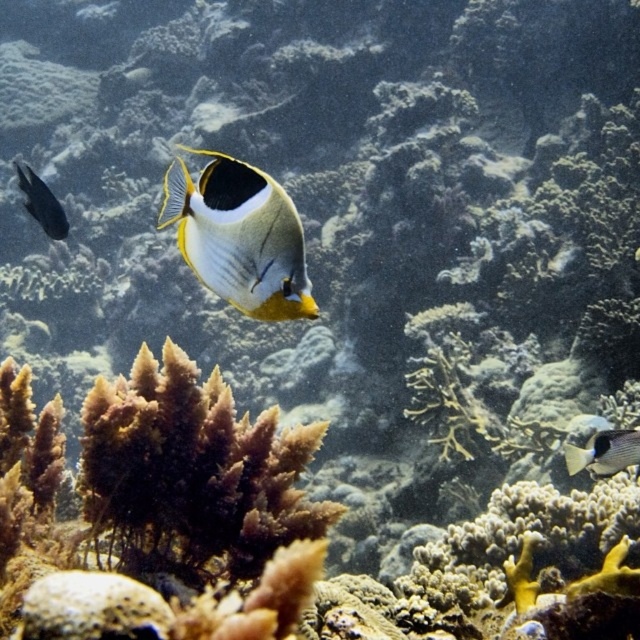
Can you confirm if yellow and white butterflyfish at center is wider than shiny black fish at left?

No, yellow and white butterflyfish at center is not wider than shiny black fish at left.

Is yellow and white butterflyfish at center thinner than shiny black fish at left?

Yes.

Does point (308, 317) lie in front of point (61, 209)?

Yes, point (308, 317) is in front of point (61, 209).

The height and width of the screenshot is (640, 640). Find the location of `yellow and white butterflyfish at center`. yellow and white butterflyfish at center is located at coordinates (240, 236).

Does yellow and white butterflyfish at center appear over gray matte fish at right?

Yes, yellow and white butterflyfish at center is above gray matte fish at right.

Can you confirm if yellow and white butterflyfish at center is smaller than gray matte fish at right?

No, yellow and white butterflyfish at center is not smaller than gray matte fish at right.

Which is behind, point (262, 173) or point (612, 460)?

The point (612, 460) is more distant.

Find the location of a particular element. yellow and white butterflyfish at center is located at coordinates (240, 236).

Between gray matte fish at right and shiny black fish at left, which one is positioned higher?

shiny black fish at left is higher up.

Who is taller, gray matte fish at right or shiny black fish at left?

shiny black fish at left is taller.

Is point (636, 474) positioned after point (54, 225)?

No.

Locate an element on the screen. The image size is (640, 640). gray matte fish at right is located at coordinates (604, 452).